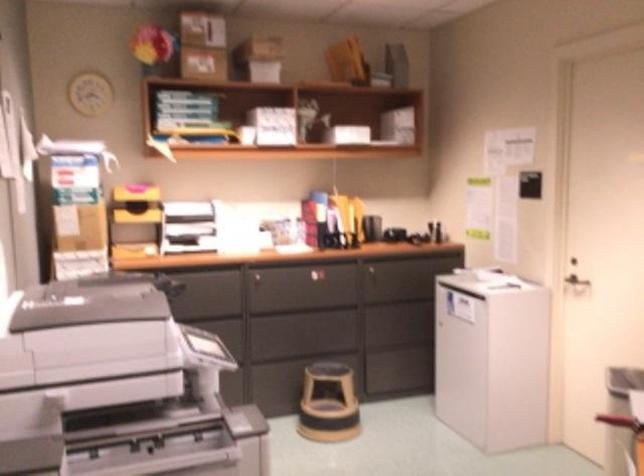
Image resolution: width=644 pixels, height=476 pixels. Identify the location of printer tray handle. pos(199,347).